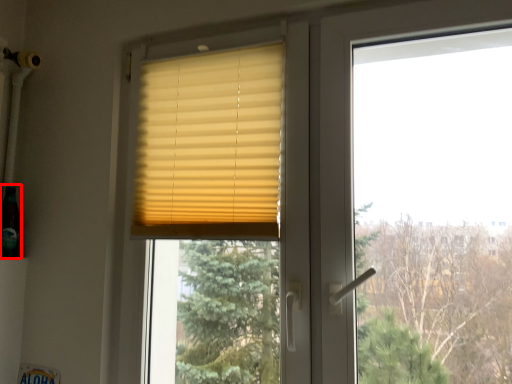
Question: From the image's perspective, where is champagne (annotated by the red box) located in relation to window blind in the image?

Choices:
 (A) below
 (B) above

Answer: (A)